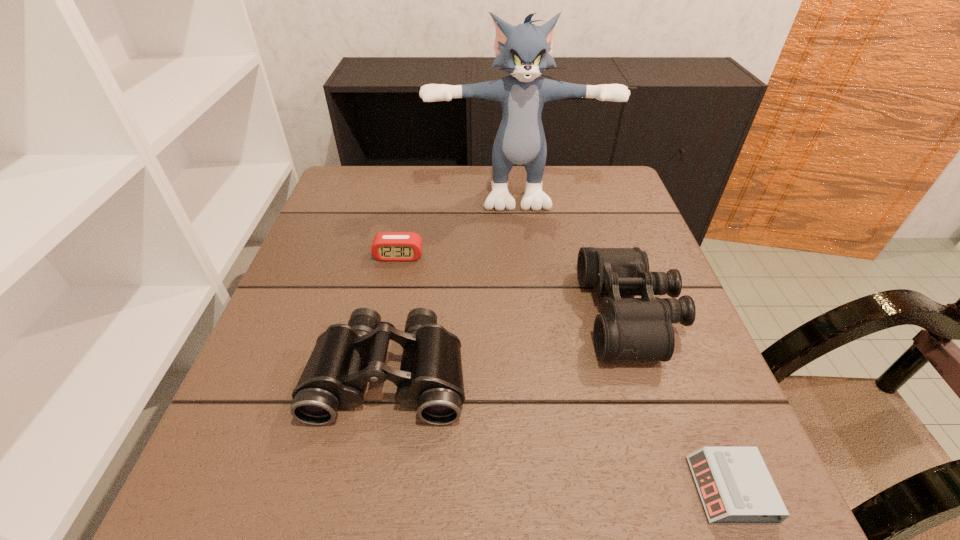
Where is `vacant point located between the left binoculars and the cat`? vacant point located between the left binoculars and the cat is located at coordinates (452, 281).

This screenshot has width=960, height=540. Find the location of `vacant area that lies between the right binoculars and the second farthest object`. vacant area that lies between the right binoculars and the second farthest object is located at coordinates (515, 285).

Locate an element on the screen. The image size is (960, 540). blank region between the farther alarm clock and the right binoculars is located at coordinates (515, 285).

You are a GUI agent. You are given a task and a screenshot of the screen. Output one action in this format:
    pyautogui.click(x=<x>, y=<y>)
    Task: Click on the free space between the right alarm clock and the right binoculars
    
    Given the screenshot: What is the action you would take?
    pyautogui.click(x=680, y=402)

Locate an element on the screen. Image resolution: width=960 pixels, height=540 pixels. vacant point located between the left binoculars and the farthest object is located at coordinates (452, 281).

What are the coordinates of `free space between the right alarm clock and the farther alarm clock` in the screenshot? It's located at (564, 373).

I want to click on free space between the left binoculars and the right binoculars, so click(510, 344).

This screenshot has width=960, height=540. What are the coordinates of `unoccupied position between the left binoculars and the right binoculars` in the screenshot? It's located at (510, 344).

Where is `free space that is in between the farthest object and the right binoculars`? This screenshot has width=960, height=540. free space that is in between the farthest object and the right binoculars is located at coordinates (573, 251).

You are a GUI agent. You are given a task and a screenshot of the screen. Output one action in this format:
    pyautogui.click(x=<x>, y=<y>)
    Task: Click on the closest object to the right binoculars
    The image size is (960, 540).
    Given the screenshot: What is the action you would take?
    pyautogui.click(x=735, y=486)